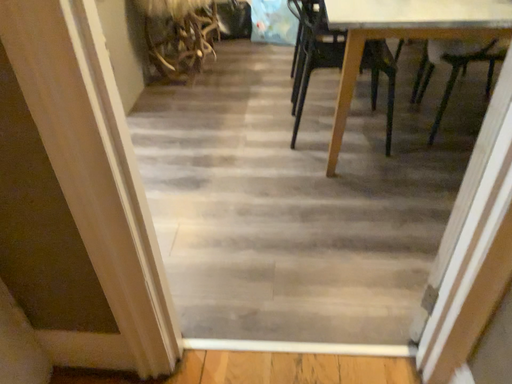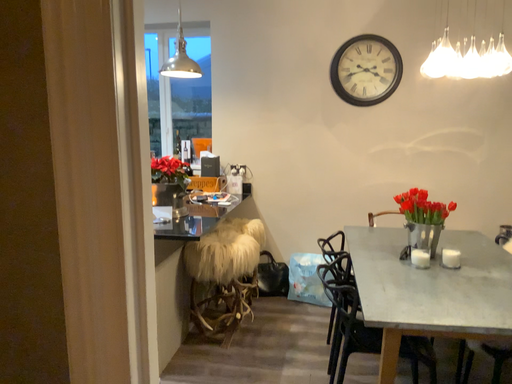
Question: How did the camera likely rotate when shooting the video?

Choices:
 (A) rotated downward
 (B) rotated upward

Answer: (B)